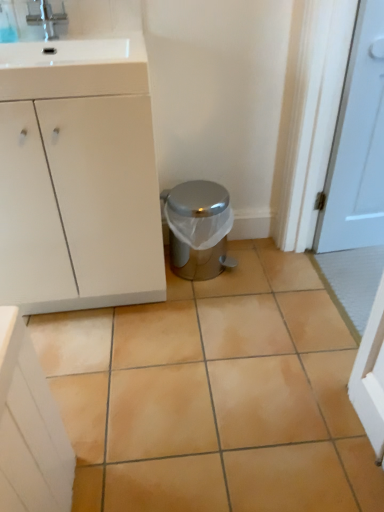
Question: From a real-world perspective, is white matte cabinet at left over satin silver trash can at center?

Choices:
 (A) no
 (B) yes

Answer: (B)

Question: Does white matte cabinet at left have a greater height compared to satin silver trash can at center?

Choices:
 (A) no
 (B) yes

Answer: (B)

Question: From the image's perspective, does white matte cabinet at left appear lower than satin silver trash can at center?

Choices:
 (A) no
 (B) yes

Answer: (A)

Question: Is white matte cabinet at left shorter than satin silver trash can at center?

Choices:
 (A) no
 (B) yes

Answer: (A)

Question: Is white matte cabinet at left positioned before satin silver trash can at center?

Choices:
 (A) no
 (B) yes

Answer: (B)

Question: Is white matte cabinet at left bigger than satin silver trash can at center?

Choices:
 (A) yes
 (B) no

Answer: (A)

Question: From the image's perspective, is white glossy sink at upper left beneath beige ceramic tile at center?

Choices:
 (A) yes
 (B) no

Answer: (B)

Question: Is white glossy sink at upper left located outside beige ceramic tile at center?

Choices:
 (A) no
 (B) yes

Answer: (B)

Question: Is white glossy sink at upper left positioned with its back to beige ceramic tile at center?

Choices:
 (A) yes
 (B) no

Answer: (B)

Question: Is white glossy sink at upper left smaller than beige ceramic tile at center?

Choices:
 (A) no
 (B) yes

Answer: (B)

Question: Can you confirm if white glossy sink at upper left is bigger than beige ceramic tile at center?

Choices:
 (A) yes
 (B) no

Answer: (B)

Question: Is beige ceramic tile at center completely or partially inside white glossy sink at upper left?

Choices:
 (A) no
 (B) yes

Answer: (A)

Question: Is white matte cabinet at left thinner than beige ceramic tile at center?

Choices:
 (A) yes
 (B) no

Answer: (A)